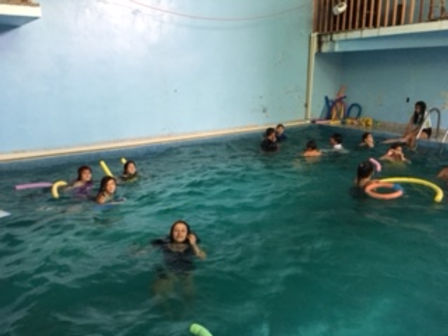
You are a GUI agent. You are given a task and a screenshot of the screen. Output one action in this format:
    pyautogui.click(x=<x>, y=<y>)
    Task: Click on the floor
    
    Given the screenshot: What is the action you would take?
    pyautogui.click(x=320, y=54)